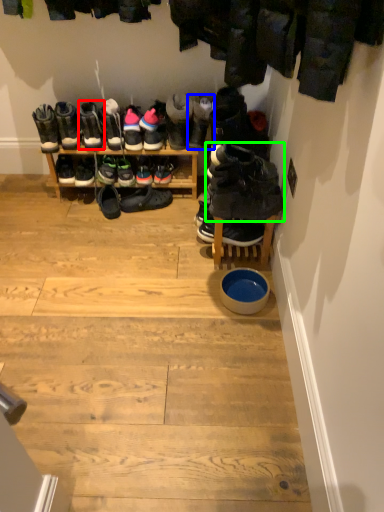
Question: Which object is positioned closest to footwear (highlighted by a red box)? Select from footwear (highlighted by a blue box) and footwear (highlighted by a green box).

Choices:
 (A) footwear
 (B) footwear

Answer: (A)